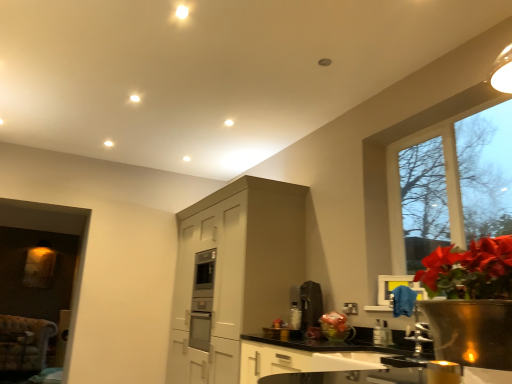
Question: From a real-world perspective, is satin black coffee maker at center on white glossy sink at lower center?

Choices:
 (A) yes
 (B) no

Answer: (A)

Question: Is satin black coffee maker at center bigger than white glossy sink at lower center?

Choices:
 (A) yes
 (B) no

Answer: (B)

Question: From the image's perspective, does satin black coffee maker at center appear lower than white glossy sink at lower center?

Choices:
 (A) yes
 (B) no

Answer: (B)

Question: Does satin black coffee maker at center have a greater width compared to white glossy sink at lower center?

Choices:
 (A) yes
 (B) no

Answer: (B)

Question: Is satin black coffee maker at center looking in the opposite direction of white glossy sink at lower center?

Choices:
 (A) yes
 (B) no

Answer: (B)

Question: From the image's perspective, does satin black coffee maker at center appear higher than white glossy sink at lower center?

Choices:
 (A) no
 (B) yes

Answer: (B)

Question: Is translucent plastic vase at lower center looking in the opposite direction of satin black coffee maker at center?

Choices:
 (A) no
 (B) yes

Answer: (A)

Question: From a real-world perspective, is translucent plastic vase at lower center below satin black coffee maker at center?

Choices:
 (A) yes
 (B) no

Answer: (A)

Question: Does translucent plastic vase at lower center appear on the right side of satin black coffee maker at center?

Choices:
 (A) yes
 (B) no

Answer: (A)

Question: Is translucent plastic vase at lower center behind satin black coffee maker at center?

Choices:
 (A) no
 (B) yes

Answer: (A)

Question: From the image's perspective, does translucent plastic vase at lower center appear higher than satin black coffee maker at center?

Choices:
 (A) no
 (B) yes

Answer: (A)

Question: Can satin black coffee maker at center be found inside translucent plastic vase at lower center?

Choices:
 (A) yes
 (B) no

Answer: (B)

Question: Can you confirm if translucent plastic vase at lower center is smaller than matte gray cabinet at center?

Choices:
 (A) yes
 (B) no

Answer: (A)